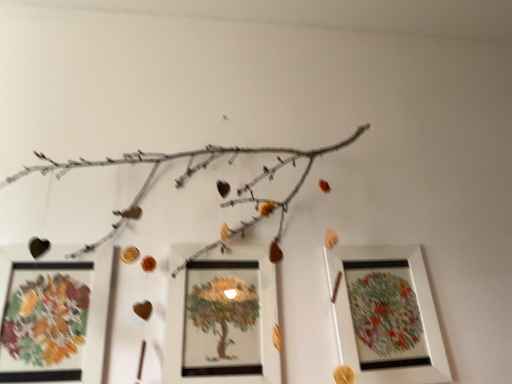
What do you see at coordinates (386, 315) in the screenshot?
I see `white matte picture frame at right, the first picture frame when ordered from right to left` at bounding box center [386, 315].

Locate an element on the screen. white matte picture frame at right, marked as the third picture frame in a left-to-right arrangement is located at coordinates (386, 315).

The width and height of the screenshot is (512, 384). I want to click on matte glass picture frame at lower left, the third picture frame from the right, so pyautogui.click(x=53, y=315).

You are a GUI agent. You are given a task and a screenshot of the screen. Output one action in this format:
    pyautogui.click(x=<x>, y=<y>)
    Task: Click on the white matte picture frame at right, the first picture frame when ordered from right to left
    The width and height of the screenshot is (512, 384).
    Given the screenshot: What is the action you would take?
    pyautogui.click(x=386, y=315)

From the image's perspective, who appears lower, matte glass picture frame at lower left, the third picture frame from the right, or white matte picture frame at right, the first picture frame when ordered from right to left?

white matte picture frame at right, the first picture frame when ordered from right to left, appears lower in the image.

Considering the relative sizes of matte glass picture frame at lower left, which ranks as the first picture frame in left-to-right order, and white matte picture frame at right, the first picture frame when ordered from right to left, in the image provided, is matte glass picture frame at lower left, which ranks as the first picture frame in left-to-right order, smaller than white matte picture frame at right, the first picture frame when ordered from right to left,?

Yes.

Could you tell me if matte glass picture frame at lower left, which ranks as the first picture frame in left-to-right order, is facing white matte picture frame at right, marked as the third picture frame in a left-to-right arrangement?

No.

Between matte glass picture frame at lower left, the third picture frame from the right, and white matte picture frame at right, marked as the third picture frame in a left-to-right arrangement, which one appears on the right side from the viewer's perspective?

Positioned to the right is white matte picture frame at right, marked as the third picture frame in a left-to-right arrangement.

From a real-world perspective, does matte white picture frame at center, positioned as the 2th picture frame in right-to-left order, sit lower than white matte picture frame at right, marked as the third picture frame in a left-to-right arrangement?

Yes, from a real-world perspective, matte white picture frame at center, positioned as the 2th picture frame in right-to-left order, is beneath white matte picture frame at right, marked as the third picture frame in a left-to-right arrangement.

From the image's perspective, which one is positioned lower, matte white picture frame at center, positioned as the 2th picture frame in left-to-right order, or white matte picture frame at right, marked as the third picture frame in a left-to-right arrangement?

From the image's view, white matte picture frame at right, marked as the third picture frame in a left-to-right arrangement, is below.

Is matte white picture frame at center, positioned as the 2th picture frame in left-to-right order, oriented away from white matte picture frame at right, the first picture frame when ordered from right to left?

No, matte white picture frame at center, positioned as the 2th picture frame in left-to-right order, is not facing away from white matte picture frame at right, the first picture frame when ordered from right to left.

Does matte white picture frame at center, positioned as the 2th picture frame in right-to-left order, come in front of white matte picture frame at right, the first picture frame when ordered from right to left?

Yes, it is in front of white matte picture frame at right, the first picture frame when ordered from right to left.

Considering the relative sizes of matte glass picture frame at lower left, the third picture frame from the right, and matte white picture frame at center, positioned as the 2th picture frame in left-to-right order, in the image provided, is matte glass picture frame at lower left, the third picture frame from the right, wider than matte white picture frame at center, positioned as the 2th picture frame in left-to-right order,?

No, matte glass picture frame at lower left, the third picture frame from the right, is not wider than matte white picture frame at center, positioned as the 2th picture frame in left-to-right order.

Does point (77, 367) appear closer or farther from the camera than point (227, 261)?

Point (77, 367).

Could matte white picture frame at center, positioned as the 2th picture frame in right-to-left order, be considered to be inside matte glass picture frame at lower left, which ranks as the first picture frame in left-to-right order?

No.

Considering the relative sizes of matte glass picture frame at lower left, which ranks as the first picture frame in left-to-right order, and matte white picture frame at center, positioned as the 2th picture frame in right-to-left order, in the image provided, is matte glass picture frame at lower left, which ranks as the first picture frame in left-to-right order, bigger than matte white picture frame at center, positioned as the 2th picture frame in right-to-left order,?

Yes, matte glass picture frame at lower left, which ranks as the first picture frame in left-to-right order, is bigger than matte white picture frame at center, positioned as the 2th picture frame in right-to-left order.

Considering the relative positions of white matte picture frame at right, the first picture frame when ordered from right to left, and matte white picture frame at center, positioned as the 2th picture frame in left-to-right order, in the image provided, is white matte picture frame at right, the first picture frame when ordered from right to left, in front of matte white picture frame at center, positioned as the 2th picture frame in left-to-right order,?

No, the depth of white matte picture frame at right, the first picture frame when ordered from right to left, is greater than that of matte white picture frame at center, positioned as the 2th picture frame in left-to-right order.

From the image's perspective, which object appears higher, white matte picture frame at right, the first picture frame when ordered from right to left, or matte white picture frame at center, positioned as the 2th picture frame in left-to-right order?

matte white picture frame at center, positioned as the 2th picture frame in left-to-right order, is shown above in the image.

Considering the relative sizes of white matte picture frame at right, the first picture frame when ordered from right to left, and matte white picture frame at center, positioned as the 2th picture frame in left-to-right order, in the image provided, is white matte picture frame at right, the first picture frame when ordered from right to left, thinner than matte white picture frame at center, positioned as the 2th picture frame in left-to-right order,?

Incorrect, the width of white matte picture frame at right, the first picture frame when ordered from right to left, is not less than that of matte white picture frame at center, positioned as the 2th picture frame in left-to-right order.

Is white matte picture frame at right, marked as the third picture frame in a left-to-right arrangement, taller than matte white picture frame at center, positioned as the 2th picture frame in left-to-right order?

Indeed, white matte picture frame at right, marked as the third picture frame in a left-to-right arrangement, has a greater height compared to matte white picture frame at center, positioned as the 2th picture frame in left-to-right order.

Is point (193, 368) less distant than point (57, 304)?

That is True.

Can you confirm if matte white picture frame at center, positioned as the 2th picture frame in right-to-left order, is thinner than matte glass picture frame at lower left, the third picture frame from the right?

In fact, matte white picture frame at center, positioned as the 2th picture frame in right-to-left order, might be wider than matte glass picture frame at lower left, the third picture frame from the right.

Can you confirm if matte white picture frame at center, positioned as the 2th picture frame in left-to-right order, is positioned to the left of matte glass picture frame at lower left, the third picture frame from the right?

No.

Who is bigger, matte white picture frame at center, positioned as the 2th picture frame in right-to-left order, or matte glass picture frame at lower left, which ranks as the first picture frame in left-to-right order?

With larger size is matte glass picture frame at lower left, which ranks as the first picture frame in left-to-right order.

In the image, is white matte picture frame at right, the first picture frame when ordered from right to left, positioned in front of or behind matte glass picture frame at lower left, the third picture frame from the right?

Clearly, white matte picture frame at right, the first picture frame when ordered from right to left, is behind matte glass picture frame at lower left, the third picture frame from the right.

Is white matte picture frame at right, marked as the third picture frame in a left-to-right arrangement, wider than matte glass picture frame at lower left, which ranks as the first picture frame in left-to-right order?

Yes, white matte picture frame at right, marked as the third picture frame in a left-to-right arrangement, is wider than matte glass picture frame at lower left, which ranks as the first picture frame in left-to-right order.

Is matte glass picture frame at lower left, which ranks as the first picture frame in left-to-right order, completely or partially inside white matte picture frame at right, marked as the third picture frame in a left-to-right arrangement?

That's incorrect, matte glass picture frame at lower left, which ranks as the first picture frame in left-to-right order, is not inside white matte picture frame at right, marked as the third picture frame in a left-to-right arrangement.

Between white matte picture frame at right, the first picture frame when ordered from right to left, and matte glass picture frame at lower left, the third picture frame from the right, which one appears on the left side from the viewer's perspective?

From the viewer's perspective, matte glass picture frame at lower left, the third picture frame from the right, appears more on the left side.

At what (x,y) coordinates should I click in order to perform the action: click on picture frame that is the 2nd object to the right of the matte glass picture frame at lower left, which ranks as the first picture frame in left-to-right order, starting at the anchor. Please return your answer as a coordinate pair (x, y). The width and height of the screenshot is (512, 384). Looking at the image, I should click on (386, 315).

Starting from the white matte picture frame at right, marked as the third picture frame in a left-to-right arrangement, which picture frame is the 1st one in front? Please provide its 2D coordinates.

[(223, 320)]

Which object lies nearer to the anchor point white matte picture frame at right, marked as the third picture frame in a left-to-right arrangement, matte white picture frame at center, positioned as the 2th picture frame in left-to-right order, or matte glass picture frame at lower left, the third picture frame from the right?

matte white picture frame at center, positioned as the 2th picture frame in left-to-right order, is closer to white matte picture frame at right, marked as the third picture frame in a left-to-right arrangement.

From the image, which object appears to be farther from matte white picture frame at center, positioned as the 2th picture frame in right-to-left order, white matte picture frame at right, marked as the third picture frame in a left-to-right arrangement, or matte glass picture frame at lower left, which ranks as the first picture frame in left-to-right order?

white matte picture frame at right, marked as the third picture frame in a left-to-right arrangement, lies further to matte white picture frame at center, positioned as the 2th picture frame in right-to-left order, than the other object.

Looking at the image, which one is located closer to white matte picture frame at right, the first picture frame when ordered from right to left, matte glass picture frame at lower left, the third picture frame from the right, or matte white picture frame at center, positioned as the 2th picture frame in right-to-left order?

The object closer to white matte picture frame at right, the first picture frame when ordered from right to left, is matte white picture frame at center, positioned as the 2th picture frame in right-to-left order.

Consider the image. Which object lies nearer to the anchor point matte glass picture frame at lower left, which ranks as the first picture frame in left-to-right order, white matte picture frame at right, marked as the third picture frame in a left-to-right arrangement, or matte white picture frame at center, positioned as the 2th picture frame in left-to-right order?

Based on the image, matte white picture frame at center, positioned as the 2th picture frame in left-to-right order, appears to be nearer to matte glass picture frame at lower left, which ranks as the first picture frame in left-to-right order.

Looking at the image, which one is located closer to matte glass picture frame at lower left, the third picture frame from the right, matte white picture frame at center, positioned as the 2th picture frame in right-to-left order, or white matte picture frame at right, the first picture frame when ordered from right to left?

matte white picture frame at center, positioned as the 2th picture frame in right-to-left order, is positioned closer to the anchor matte glass picture frame at lower left, the third picture frame from the right.

Which object lies nearer to the anchor point matte white picture frame at center, positioned as the 2th picture frame in left-to-right order, matte glass picture frame at lower left, the third picture frame from the right, or white matte picture frame at right, the first picture frame when ordered from right to left?

Among the two, matte glass picture frame at lower left, the third picture frame from the right, is located nearer to matte white picture frame at center, positioned as the 2th picture frame in left-to-right order.

What are the coordinates of `picture frame between matte glass picture frame at lower left, the third picture frame from the right, and white matte picture frame at right, the first picture frame when ordered from right to left` in the screenshot? It's located at (223, 320).